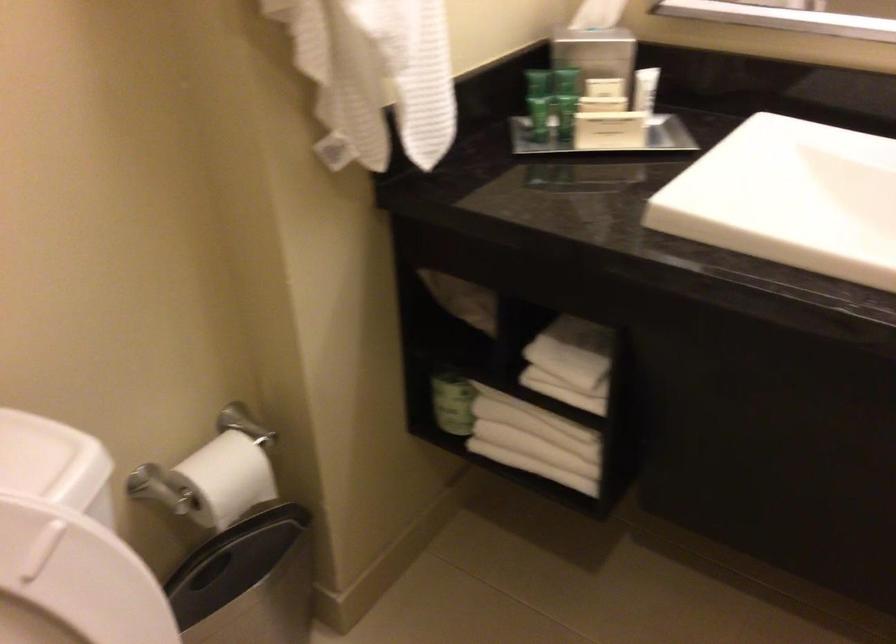
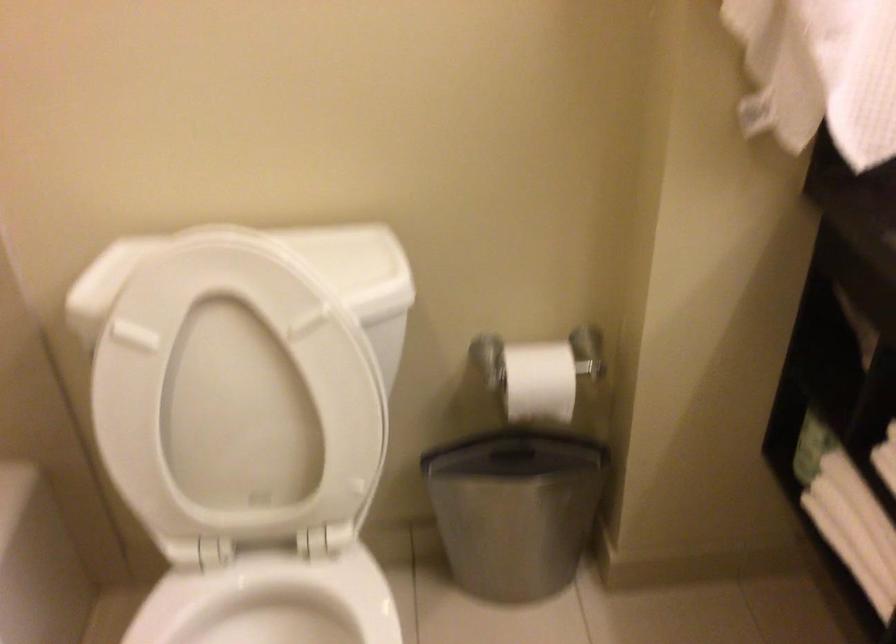
Question: Based on the continuous images, in which direction is the camera rotating? Reply with the corresponding letter.

Choices:
 (A) Left
 (B) Right
 (C) Up
 (D) Down

Answer: (A)